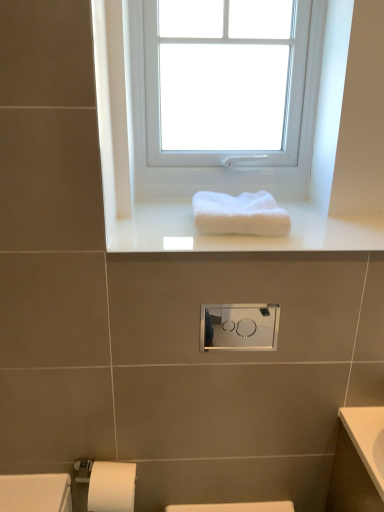
Where is `vacant area located to the right-hand side of white fluffy towel at center`? This screenshot has height=512, width=384. vacant area located to the right-hand side of white fluffy towel at center is located at coordinates (326, 234).